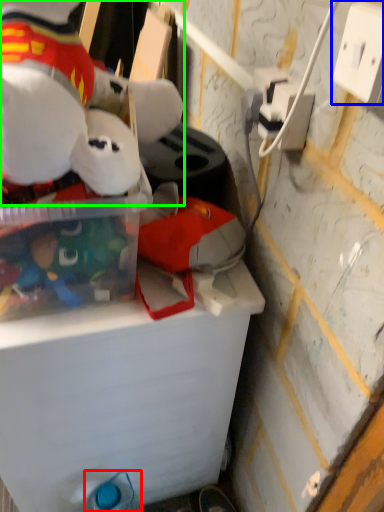
Question: Which object is the closest to the bottle (highlighted by a red box)? Choose among these: power outlet (highlighted by a blue box) or toy (highlighted by a green box).

Choices:
 (A) power outlet
 (B) toy

Answer: (B)